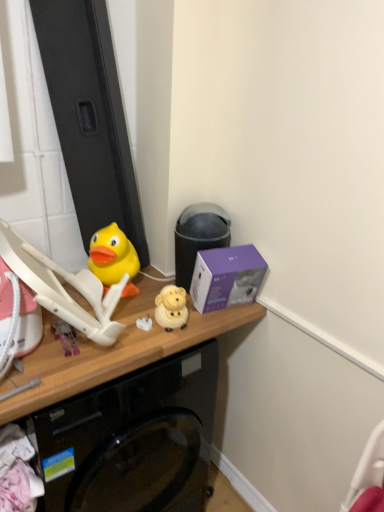
Question: Which direction should I rotate to face white matte plug at center, which appears as the third toy when viewed from the left, — up or down?

Choices:
 (A) down
 (B) up

Answer: (A)

Question: From the image's perspective, does white matte plug at center, which is the 2th toy from right to left, appear lower than yellow rubber duck at left, which is counted as the third toy, starting from the right?

Choices:
 (A) no
 (B) yes

Answer: (B)

Question: Is white matte plug at center, which is the 2th toy from right to left, facing towards yellow rubber duck at left, which is counted as the third toy, starting from the right?

Choices:
 (A) yes
 (B) no

Answer: (B)

Question: Does white matte plug at center, which appears as the third toy when viewed from the left, have a greater width compared to yellow rubber duck at left, positioned as the second toy in left-to-right order?

Choices:
 (A) yes
 (B) no

Answer: (B)

Question: Is white matte plug at center, which appears as the third toy when viewed from the left, shorter than yellow rubber duck at left, which is counted as the third toy, starting from the right?

Choices:
 (A) yes
 (B) no

Answer: (A)

Question: Is white matte plug at center, which appears as the third toy when viewed from the left, at the left side of yellow rubber duck at left, which is counted as the third toy, starting from the right?

Choices:
 (A) no
 (B) yes

Answer: (A)

Question: Is white matte plug at center, which appears as the third toy when viewed from the left, positioned with its back to yellow rubber duck at left, which is counted as the third toy, starting from the right?

Choices:
 (A) yes
 (B) no

Answer: (A)

Question: From a real-world perspective, does matte black trash can at center sit lower than wooden desk at center?

Choices:
 (A) yes
 (B) no

Answer: (B)

Question: Does matte black trash can at center have a lesser height compared to wooden desk at center?

Choices:
 (A) no
 (B) yes

Answer: (B)

Question: Is matte black trash can at center positioned before wooden desk at center?

Choices:
 (A) yes
 (B) no

Answer: (B)

Question: Considering the relative sizes of matte black trash can at center and wooden desk at center in the image provided, is matte black trash can at center bigger than wooden desk at center?

Choices:
 (A) yes
 (B) no

Answer: (B)

Question: Considering the relative sizes of matte black trash can at center and wooden desk at center in the image provided, is matte black trash can at center thinner than wooden desk at center?

Choices:
 (A) no
 (B) yes

Answer: (B)

Question: Is wooden desk at center surrounded by matte black trash can at center?

Choices:
 (A) no
 (B) yes

Answer: (A)

Question: Does white matte plug at center, which is the 2th toy from right to left, appear on the left side of purple matte box at upper right?

Choices:
 (A) no
 (B) yes

Answer: (B)